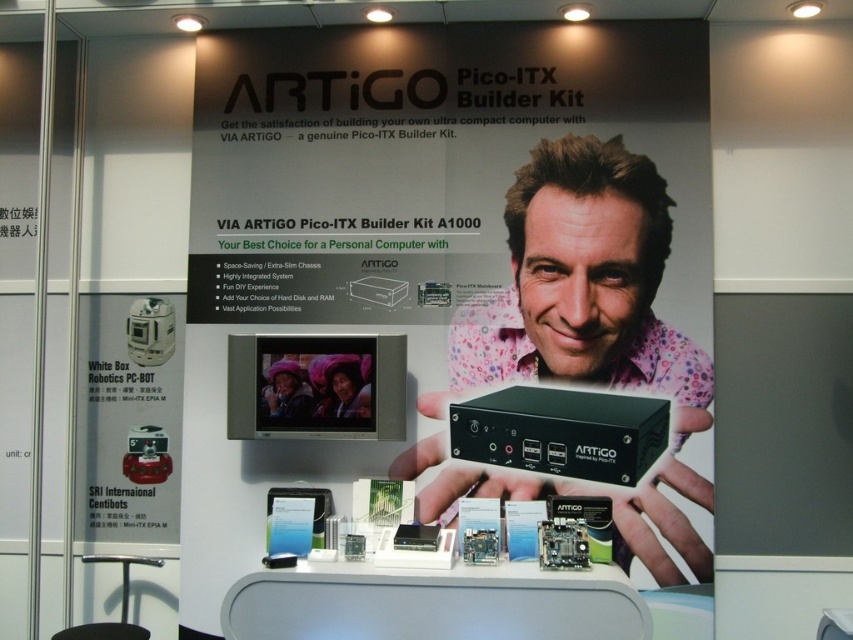
Question: Considering the relative positions of matte black computer at center and black plastic artigo pico-itx builder kit at center in the image provided, where is matte black computer at center located with respect to black plastic artigo pico-itx builder kit at center?

Choices:
 (A) left
 (B) right

Answer: (A)

Question: Which object appears closest to the camera in this image?

Choices:
 (A) white matte robot at left
 (B) black plastic artigo pico-itx builder kit at center

Answer: (B)

Question: Which object is closer to the camera taking this photo?

Choices:
 (A) matte black computer at center
 (B) black plastic artigo pico-itx builder kit at center

Answer: (B)

Question: Can you confirm if matte black computer at center is wider than black plastic artigo pico-itx builder kit at center?

Choices:
 (A) no
 (B) yes

Answer: (B)

Question: Which of these objects is positioned farthest from the matte black computer at center?

Choices:
 (A) white matte robot at left
 (B) black plastic artigo pico-itx builder kit at center

Answer: (A)

Question: Can you confirm if matte black computer at center is positioned above white matte robot at left?

Choices:
 (A) yes
 (B) no

Answer: (A)